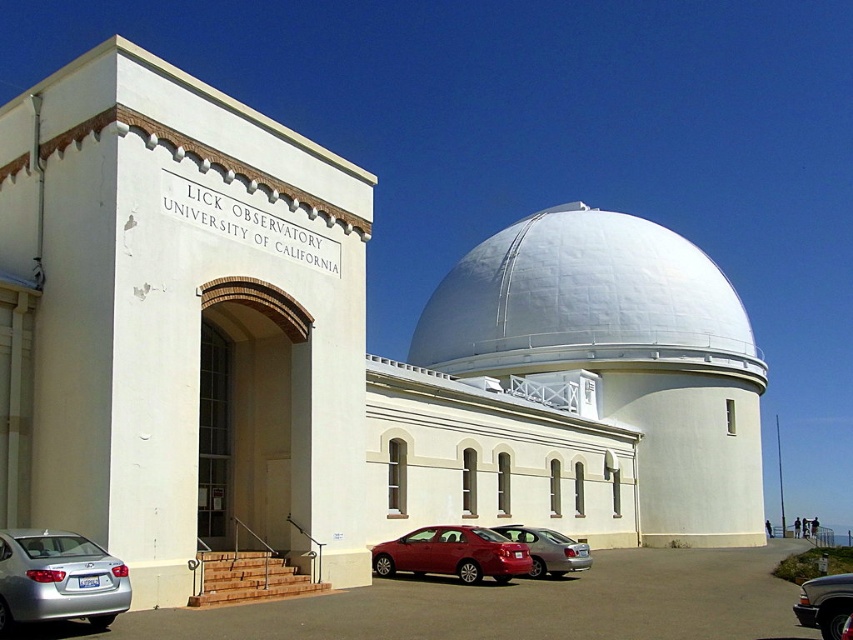
You are standing at the entrance of the Lick Observatory and want to park your car. You see the white smooth dome at center and the metallic red sedan at center. Which object is closer to you?

The metallic red sedan at center is closer to you because the white smooth dome at center is positioned over it, indicating that the dome is above the sedan.

Consider the image. You are standing in front of the Lick Observatory and want to park your car. There is a white smooth dome at center and a metallic red sedan at center. Which object should you avoid parking too close to, and why?

You should avoid parking too close to the white smooth dome at center because it is part of the observatory building and likely has restricted access. The metallic red sedan at center is already parked in the area, but the dome is a fixed structure and cannot be moved.

You are standing at the point marked by the coordinates (583,300) in the image of the Lick Observatory. What object is exactly at that location?

The white smooth dome at center is located at point (583,300).